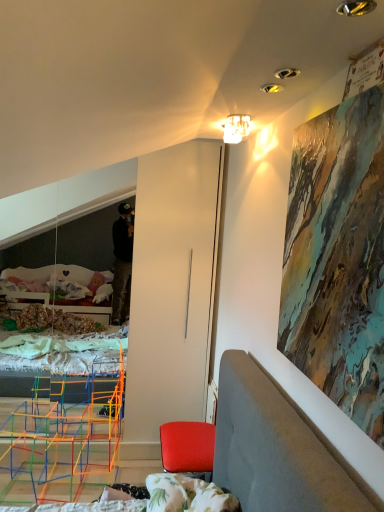
What do you see at coordinates (236, 128) in the screenshot? I see `matte glass chandelier at upper center` at bounding box center [236, 128].

What is the approximate width of matte glass chandelier at upper center?

matte glass chandelier at upper center is 4.87 inches wide.

Locate an element on the screen. This screenshot has width=384, height=512. matte glass chandelier at upper center is located at coordinates (236, 128).

The height and width of the screenshot is (512, 384). Find the location of `red leather chair at lower right`. red leather chair at lower right is located at coordinates [187, 446].

Describe the element at coordinates (187, 446) in the screenshot. I see `red leather chair at lower right` at that location.

Find the location of a particular element. The image size is (384, 512). matte glass chandelier at upper center is located at coordinates (236, 128).

Which object is positioned more to the right, red leather chair at lower right or matte glass chandelier at upper center?

From the viewer's perspective, matte glass chandelier at upper center appears more on the right side.

Is red leather chair at lower right behind matte glass chandelier at upper center?

Yes, red leather chair at lower right is further from the camera.

Is point (170, 459) closer or farther from the camera than point (236, 117)?

Clearly, point (170, 459) is more distant from the camera than point (236, 117).

From the image's perspective, is red leather chair at lower right above or below matte glass chandelier at upper center?

red leather chair at lower right is below matte glass chandelier at upper center.

From a real-world perspective, who is located lower, red leather chair at lower right or matte glass chandelier at upper center?

red leather chair at lower right is physically lower.

Looking at this image, can you confirm if red leather chair at lower right is thinner than matte glass chandelier at upper center?

No.

Is red leather chair at lower right taller or shorter than matte glass chandelier at upper center?

Clearly, red leather chair at lower right is taller compared to matte glass chandelier at upper center.

Is red leather chair at lower right bigger than matte glass chandelier at upper center?

Yes, red leather chair at lower right is bigger than matte glass chandelier at upper center.

Do you think red leather chair at lower right is within matte glass chandelier at upper center, or outside of it?

red leather chair at lower right exists outside the volume of matte glass chandelier at upper center.

Does red leather chair at lower right touch matte glass chandelier at upper center?

No, red leather chair at lower right is not making contact with matte glass chandelier at upper center.

Does red leather chair at lower right turn towards matte glass chandelier at upper center?

No.

How many degrees apart are the facing directions of red leather chair at lower right and matte glass chandelier at upper center?

They differ by 13.9 degrees in their facing directions.

The height and width of the screenshot is (512, 384). Find the location of `chair on the left of the matte glass chandelier at upper center`. chair on the left of the matte glass chandelier at upper center is located at coordinates (x=187, y=446).

In the image, is matte glass chandelier at upper center on the left side or the right side of red leather chair at lower right?

In the image, matte glass chandelier at upper center appears on the right side of red leather chair at lower right.

Between matte glass chandelier at upper center and red leather chair at lower right, which one is positioned behind?

Positioned behind is red leather chair at lower right.

Considering the positions of points (240, 133) and (190, 452), is point (240, 133) closer to camera compared to point (190, 452)?

Yes, it is.

From the image's perspective, which one is positioned higher, matte glass chandelier at upper center or red leather chair at lower right?

matte glass chandelier at upper center appears higher in the image.

From a real-world perspective, which is physically below, matte glass chandelier at upper center or red leather chair at lower right?

From a 3D spatial view, red leather chair at lower right is below.

Can you confirm if matte glass chandelier at upper center is wider than red leather chair at lower right?

No.

Does matte glass chandelier at upper center have a lesser height compared to red leather chair at lower right?

Correct, matte glass chandelier at upper center is not as tall as red leather chair at lower right.

Based on their sizes in the image, would you say matte glass chandelier at upper center is bigger or smaller than red leather chair at lower right?

Considering their sizes, matte glass chandelier at upper center takes up less space than red leather chair at lower right.

Can we say matte glass chandelier at upper center lies outside red leather chair at lower right?

matte glass chandelier at upper center lies outside red leather chair at lower right's area.

Is matte glass chandelier at upper center not close to red leather chair at lower right?

That's right, there is a large distance between matte glass chandelier at upper center and red leather chair at lower right.

Could you tell me if matte glass chandelier at upper center is turned towards red leather chair at lower right?

No, matte glass chandelier at upper center is not oriented towards red leather chair at lower right.

I want to click on lamp positioned vertically above the red leather chair at lower right (from a real-world perspective), so click(236, 128).

Identify the location of chair that appears behind the matte glass chandelier at upper center. The width and height of the screenshot is (384, 512). (x=187, y=446).

Locate an element on the screen. This screenshot has width=384, height=512. chair on the left of matte glass chandelier at upper center is located at coordinates (187, 446).